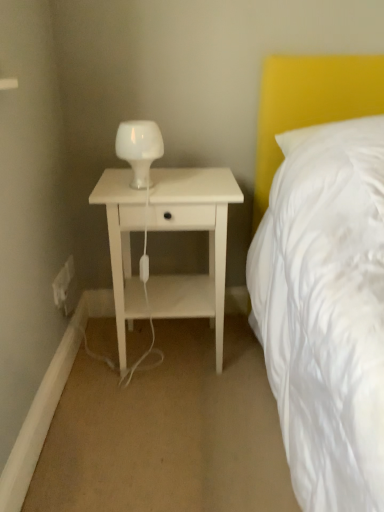
This screenshot has height=512, width=384. What do you see at coordinates (193, 230) in the screenshot?
I see `white matte nightstand at center` at bounding box center [193, 230].

The height and width of the screenshot is (512, 384). Identify the location of white glass lamp at center. (139, 149).

Describe the element at coordinates (139, 149) in the screenshot. I see `white glass lamp at center` at that location.

Locate an element on the screen. The width and height of the screenshot is (384, 512). white plastic electric outlet at lower left, the first electric outlet viewed from the back is located at coordinates (x=69, y=268).

Find the location of a particular element. Image resolution: width=384 pixels, height=512 pixels. white matte nightstand at center is located at coordinates (193, 230).

Based on the photo, what's the angular difference between white glass lamp at center and white matte nightstand at center's facing directions?

They differ by 0.391 degrees in their facing directions.

Which of these two, white glass lamp at center or white matte nightstand at center, is thinner?

white glass lamp at center is thinner.

Is white glass lamp at center with white matte nightstand at center?

No.

Based on the photo, is white glass lamp at center positioned with its back to white matte nightstand at center?

No.

Can you confirm if white plastic electric outlet at lower left, the first electric outlet viewed from the back, is thinner than white matte nightstand at center?

Indeed, white plastic electric outlet at lower left, the first electric outlet viewed from the back, has a lesser width compared to white matte nightstand at center.

The width and height of the screenshot is (384, 512). I want to click on nightstand on the right of white plastic electric outlet at lower left, arranged as the 2th electric outlet when viewed from the front, so click(x=193, y=230).

Does point (69, 277) come closer to viewer compared to point (217, 211)?

No, (69, 277) is behind (217, 211).

Based on the photo, can we say white plastic electric outlet at lower left, the first electric outlet viewed from the back, lies outside white matte nightstand at center?

Indeed, white plastic electric outlet at lower left, the first electric outlet viewed from the back, is completely outside white matte nightstand at center.

From a real-world perspective, which is physically below, white plastic electric outlet at lower left, arranged as the 2th electric outlet when viewed from the front, or white plastic electric outlet at lower left, which appears as the first electric outlet when viewed from the front?

white plastic electric outlet at lower left, which appears as the first electric outlet when viewed from the front, is physically lower.

Which object is positioned more to the right, white plastic electric outlet at lower left, arranged as the 2th electric outlet when viewed from the front, or white plastic electric outlet at lower left, which appears as the first electric outlet when viewed from the front?

Positioned to the right is white plastic electric outlet at lower left, which appears as the first electric outlet when viewed from the front.

Is white plastic electric outlet at lower left, arranged as the second electric outlet when viewed from the back, at the back of white plastic electric outlet at lower left, arranged as the 2th electric outlet when viewed from the front?

white plastic electric outlet at lower left, arranged as the 2th electric outlet when viewed from the front, does not have its back to white plastic electric outlet at lower left, arranged as the second electric outlet when viewed from the back.

Is white plastic electric outlet at lower left, which appears as the first electric outlet when viewed from the front, surrounded by white plastic electric outlet at lower left, arranged as the 2th electric outlet when viewed from the front?

No, white plastic electric outlet at lower left, which appears as the first electric outlet when viewed from the front, is not inside white plastic electric outlet at lower left, arranged as the 2th electric outlet when viewed from the front.

Is white plastic electric outlet at lower left, arranged as the second electric outlet when viewed from the back, oriented towards white matte nightstand at center?

Yes, white plastic electric outlet at lower left, arranged as the second electric outlet when viewed from the back, is oriented towards white matte nightstand at center.

From a real-world perspective, is white plastic electric outlet at lower left, arranged as the second electric outlet when viewed from the back, on white matte nightstand at center?

Actually, white plastic electric outlet at lower left, arranged as the second electric outlet when viewed from the back, is physically below white matte nightstand at center in the real world.

Which is more to the left, white plastic electric outlet at lower left, arranged as the second electric outlet when viewed from the back, or white matte nightstand at center?

Positioned to the left is white plastic electric outlet at lower left, arranged as the second electric outlet when viewed from the back.

Considering the sizes of objects white matte nightstand at center and white plastic electric outlet at lower left, which appears as the first electric outlet when viewed from the front, in the image provided, who is smaller, white matte nightstand at center or white plastic electric outlet at lower left, which appears as the first electric outlet when viewed from the front,?

white plastic electric outlet at lower left, which appears as the first electric outlet when viewed from the front.

Identify the location of nightstand on the right of white plastic electric outlet at lower left, which appears as the first electric outlet when viewed from the front. Image resolution: width=384 pixels, height=512 pixels. (193, 230).

From a real-world perspective, between white matte nightstand at center and white plastic electric outlet at lower left, which appears as the first electric outlet when viewed from the front, who is vertically lower?

In real-world perspective, white plastic electric outlet at lower left, which appears as the first electric outlet when viewed from the front, is lower.

In terms of width, does white plastic electric outlet at lower left, arranged as the 2th electric outlet when viewed from the front, look wider or thinner when compared to white glass lamp at center?

In the image, white plastic electric outlet at lower left, arranged as the 2th electric outlet when viewed from the front, appears to be more narrow than white glass lamp at center.

Between point (74, 266) and point (152, 156), which one is positioned behind?

The point (74, 266) is behind.

Is white plastic electric outlet at lower left, the first electric outlet viewed from the back, oriented towards white glass lamp at center?

No, white plastic electric outlet at lower left, the first electric outlet viewed from the back, does not turn towards white glass lamp at center.

From a real-world perspective, relative to white glass lamp at center, is white plastic electric outlet at lower left, arranged as the 2th electric outlet when viewed from the front, vertically above or below?

In terms of real-world spatial position, white plastic electric outlet at lower left, arranged as the 2th electric outlet when viewed from the front, is below white glass lamp at center.

Does white glass lamp at center appear on the left side of white plastic electric outlet at lower left, the first electric outlet viewed from the back?

No, white glass lamp at center is not to the left of white plastic electric outlet at lower left, the first electric outlet viewed from the back.

Is white glass lamp at center in front of or behind white plastic electric outlet at lower left, the first electric outlet viewed from the back, in the image?

white glass lamp at center is positioned closer to the viewer than white plastic electric outlet at lower left, the first electric outlet viewed from the back.

Is white glass lamp at center positioned with its back to white plastic electric outlet at lower left, the first electric outlet viewed from the back?

white glass lamp at center does not have its back to white plastic electric outlet at lower left, the first electric outlet viewed from the back.

Where is `nightstand that appears on the right of white glass lamp at center`? This screenshot has width=384, height=512. nightstand that appears on the right of white glass lamp at center is located at coordinates (193, 230).

Find the location of a particular element. The image size is (384, 512). the 2nd electric outlet counting from the left of the white matte nightstand at center is located at coordinates (69, 268).

Looking at the image, which one is located closer to white plastic electric outlet at lower left, the first electric outlet viewed from the back, white matte nightstand at center or white plastic electric outlet at lower left, arranged as the second electric outlet when viewed from the back?

white plastic electric outlet at lower left, arranged as the second electric outlet when viewed from the back, lies closer to white plastic electric outlet at lower left, the first electric outlet viewed from the back, than the other object.

Which object lies nearer to the anchor point white matte nightstand at center, white plastic electric outlet at lower left, arranged as the second electric outlet when viewed from the back, or white plastic electric outlet at lower left, arranged as the 2th electric outlet when viewed from the front?

Based on the image, white plastic electric outlet at lower left, arranged as the second electric outlet when viewed from the back, appears to be nearer to white matte nightstand at center.

Estimate the real-world distances between objects in this image. Which object is closer to white matte nightstand at center, white plastic electric outlet at lower left, arranged as the 2th electric outlet when viewed from the front, or white plastic electric outlet at lower left, arranged as the second electric outlet when viewed from the back?

white plastic electric outlet at lower left, arranged as the second electric outlet when viewed from the back, lies closer to white matte nightstand at center than the other object.

Estimate the real-world distances between objects in this image. Which object is further from white plastic electric outlet at lower left, the first electric outlet viewed from the back, white plastic electric outlet at lower left, arranged as the second electric outlet when viewed from the back, or white glass lamp at center?

The object further to white plastic electric outlet at lower left, the first electric outlet viewed from the back, is white glass lamp at center.

Considering their positions, is white plastic electric outlet at lower left, arranged as the second electric outlet when viewed from the back, positioned further to white glass lamp at center than white plastic electric outlet at lower left, arranged as the 2th electric outlet when viewed from the front?

Based on the image, white plastic electric outlet at lower left, arranged as the 2th electric outlet when viewed from the front, appears to be further to white glass lamp at center.

Looking at the image, which one is located further to white matte nightstand at center, white plastic electric outlet at lower left, which appears as the first electric outlet when viewed from the front, or white glass lamp at center?

white plastic electric outlet at lower left, which appears as the first electric outlet when viewed from the front.

Looking at the image, which one is located further to white matte nightstand at center, white plastic electric outlet at lower left, the first electric outlet viewed from the back, or white glass lamp at center?

white plastic electric outlet at lower left, the first electric outlet viewed from the back.

From the image, which object appears to be farther from white plastic electric outlet at lower left, which appears as the first electric outlet when viewed from the front, white plastic electric outlet at lower left, arranged as the 2th electric outlet when viewed from the front, or white matte nightstand at center?

white matte nightstand at center is positioned further to the anchor white plastic electric outlet at lower left, which appears as the first electric outlet when viewed from the front.

At what (x,y) coordinates should I click in order to perform the action: click on nightstand between white glass lamp at center and white plastic electric outlet at lower left, arranged as the second electric outlet when viewed from the back, vertically. Please return your answer as a coordinate pair (x, y). The height and width of the screenshot is (512, 384). Looking at the image, I should click on (193, 230).

Locate an element on the screen. This screenshot has height=512, width=384. electric outlet between white plastic electric outlet at lower left, the first electric outlet viewed from the back, and white matte nightstand at center is located at coordinates (62, 284).

Where is `bedside lamp located between white matte nightstand at center and white plastic electric outlet at lower left, arranged as the 2th electric outlet when viewed from the front, in the depth direction`? This screenshot has height=512, width=384. bedside lamp located between white matte nightstand at center and white plastic electric outlet at lower left, arranged as the 2th electric outlet when viewed from the front, in the depth direction is located at coordinates (139, 149).

Locate an element on the screen. The width and height of the screenshot is (384, 512). electric outlet that lies between white glass lamp at center and white plastic electric outlet at lower left, arranged as the second electric outlet when viewed from the back, from top to bottom is located at coordinates (69, 268).